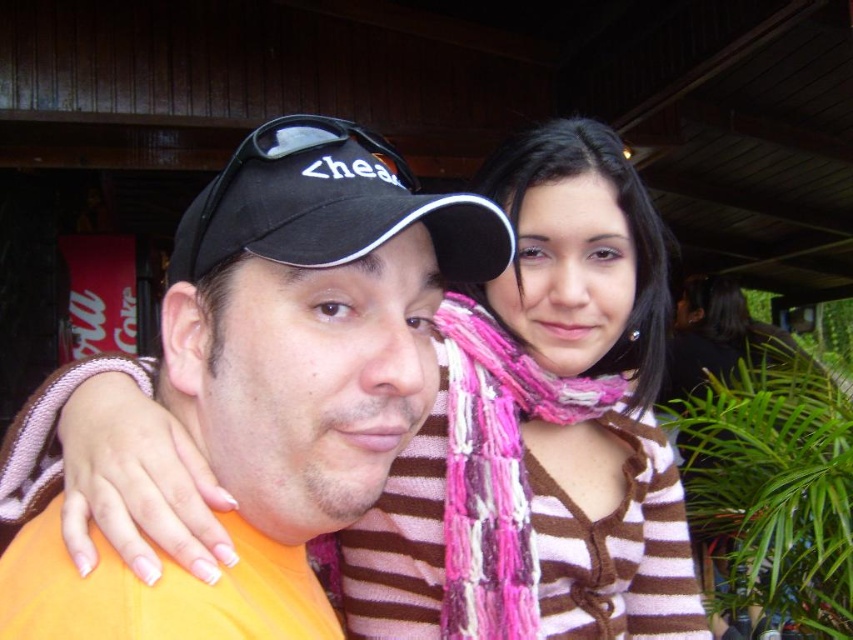
You are an artist trying to sketch this scene. You want to ensure that the sizes of the black fabric baseball cap at center and the pink yarn scarf at center are proportionally accurate. Which object should you draw smaller?

The black fabric baseball cap at center occupies less space than the pink yarn scarf at center, so you should draw the black fabric baseball cap at center smaller.

From the picture: You are a photographer trying to capture a clear photo of the pink yarn scarf at center. The orange fabric shirt at center is blocking your view. Can you adjust your position to take the photo without moving the subjects?

The orange fabric shirt at center is in front of the pink yarn scarf at center, so you can move your camera position to the side to avoid the obstruction caused by the orange fabric shirt at center and capture the pink yarn scarf at center clearly.